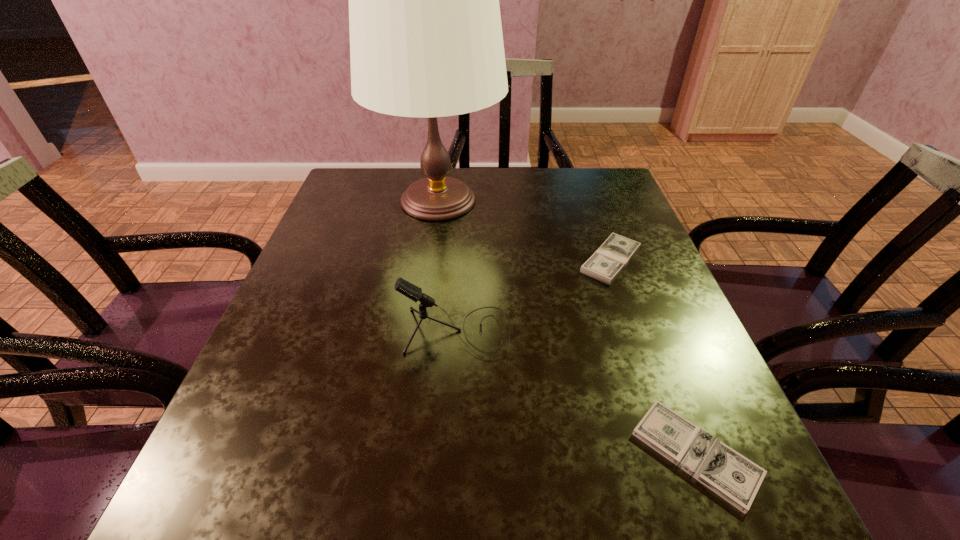
Where is `vacant area between the lamp and the second tallest object`? Image resolution: width=960 pixels, height=540 pixels. vacant area between the lamp and the second tallest object is located at coordinates (447, 267).

Where is `free space between the taller dollar and the nearest object`? free space between the taller dollar and the nearest object is located at coordinates (653, 357).

The width and height of the screenshot is (960, 540). Find the location of `free space between the microphone and the third tallest object`. free space between the microphone and the third tallest object is located at coordinates (534, 296).

Where is `free area in between the shortest object and the second shortest object`? The height and width of the screenshot is (540, 960). free area in between the shortest object and the second shortest object is located at coordinates (653, 357).

Identify which object is located as the third nearest to the nearest object. Please provide its 2D coordinates. Your answer should be formatted as a tuple, i.e. [(x, y)], where the tuple contains the x and y coordinates of a point satisfying the conditions above.

[(426, 40)]

Identify which object is the second closest to the shorter dollar. Please provide its 2D coordinates. Your answer should be formatted as a tuple, i.e. [(x, y)], where the tuple contains the x and y coordinates of a point satisfying the conditions above.

[(608, 261)]

Locate an element on the screen. The width and height of the screenshot is (960, 540). vacant space that satisfies the following two spatial constraints: 1. on the stand of the nearest object; 2. on the right side of the microphone is located at coordinates (449, 454).

The width and height of the screenshot is (960, 540). Find the location of `vacant space that satisfies the following two spatial constraints: 1. on the back side of the shorter dollar; 2. on the stand of the third shortest object`. vacant space that satisfies the following two spatial constraints: 1. on the back side of the shorter dollar; 2. on the stand of the third shortest object is located at coordinates pyautogui.click(x=649, y=333).